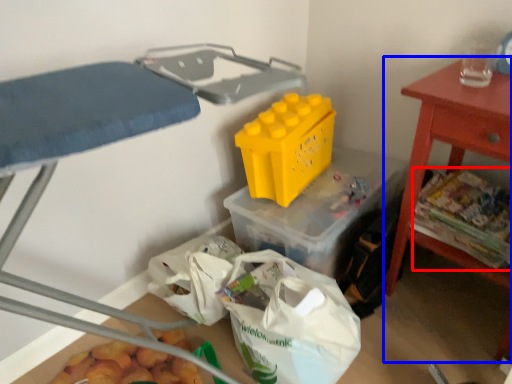
Question: Which point is further to the camera, food (highlighted by a red box) or table (highlighted by a blue box)?

Choices:
 (A) food
 (B) table

Answer: (A)